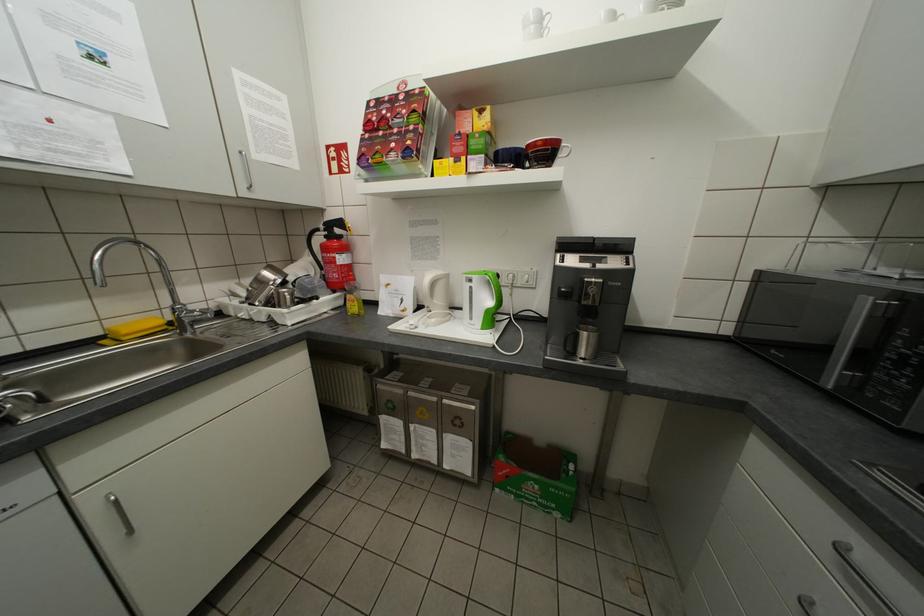
Locate an element on the screen. The width and height of the screenshot is (924, 616). faucet handle is located at coordinates (188, 317).